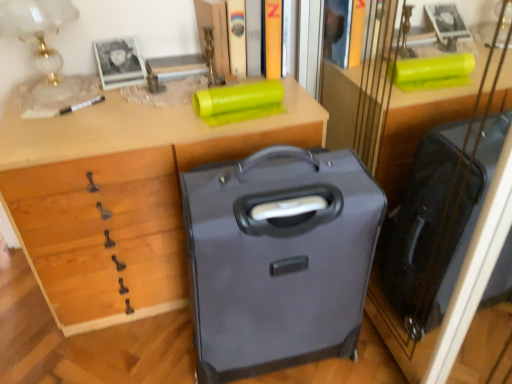
Question: Considering the relative sizes of matte gray suitcase at center and hardcover book at upper center, arranged as the second book when viewed from the left, in the image provided, is matte gray suitcase at center taller than hardcover book at upper center, arranged as the second book when viewed from the left,?

Choices:
 (A) yes
 (B) no

Answer: (A)

Question: Are matte gray suitcase at center and hardcover book at upper center, which is the 1th book from right to left, beside each other?

Choices:
 (A) yes
 (B) no

Answer: (B)

Question: Is matte gray suitcase at center not inside hardcover book at upper center, which is the 1th book from right to left?

Choices:
 (A) yes
 (B) no

Answer: (A)

Question: Can you confirm if matte gray suitcase at center is positioned to the left of hardcover book at upper center, which is the 1th book from right to left?

Choices:
 (A) yes
 (B) no

Answer: (A)

Question: Is matte gray suitcase at center shorter than hardcover book at upper center, which is the 1th book from right to left?

Choices:
 (A) no
 (B) yes

Answer: (A)

Question: From the image's perspective, is matte gray suitcase at center above or below matte plastic book at upper center, the 2th book from the right?

Choices:
 (A) below
 (B) above

Answer: (A)

Question: From their relative heights in the image, would you say matte gray suitcase at center is taller or shorter than matte plastic book at upper center, the 2th book from the right?

Choices:
 (A) short
 (B) tall

Answer: (B)

Question: In the image, is matte gray suitcase at center positioned in front of or behind matte plastic book at upper center, the 2th book from the right?

Choices:
 (A) front
 (B) behind

Answer: (A)

Question: Looking at the image, does matte gray suitcase at center seem bigger or smaller compared to matte plastic book at upper center, positioned as the first book in left-to-right order?

Choices:
 (A) small
 (B) big

Answer: (B)

Question: Visually, is matte glass table lamp at upper left positioned to the left or to the right of matte gray suitcase at center?

Choices:
 (A) right
 (B) left

Answer: (B)

Question: In the image, is matte glass table lamp at upper left positioned in front of or behind matte gray suitcase at center?

Choices:
 (A) behind
 (B) front

Answer: (A)

Question: Is point (61, 21) closer or farther from the camera than point (203, 208)?

Choices:
 (A) farther
 (B) closer

Answer: (A)

Question: Is matte glass table lamp at upper left bigger or smaller than matte gray suitcase at center?

Choices:
 (A) small
 (B) big

Answer: (A)

Question: Based on their sizes in the image, would you say matte plastic book at upper center, positioned as the first book in left-to-right order, is bigger or smaller than matte glass table lamp at upper left?

Choices:
 (A) big
 (B) small

Answer: (B)

Question: From the image's perspective, relative to matte glass table lamp at upper left, is matte plastic book at upper center, positioned as the first book in left-to-right order, above or below?

Choices:
 (A) below
 (B) above

Answer: (B)